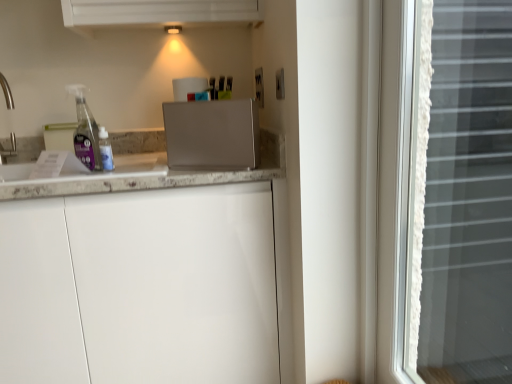
Question: Does white matte cabinet at center have a smaller size compared to satin silver toaster at center?

Choices:
 (A) yes
 (B) no

Answer: (B)

Question: Does white matte cabinet at center have a greater width compared to satin silver toaster at center?

Choices:
 (A) yes
 (B) no

Answer: (A)

Question: Is white matte cabinet at center far away from satin silver toaster at center?

Choices:
 (A) no
 (B) yes

Answer: (A)

Question: Considering the relative sizes of white matte cabinet at center and satin silver toaster at center in the image provided, is white matte cabinet at center thinner than satin silver toaster at center?

Choices:
 (A) yes
 (B) no

Answer: (B)

Question: Is white matte cabinet at center bigger than satin silver toaster at center?

Choices:
 (A) yes
 (B) no

Answer: (A)

Question: Is white matte cabinet at center oriented away from satin silver toaster at center?

Choices:
 (A) yes
 (B) no

Answer: (B)

Question: Is white marble countertop at left behind white matte cabinet at center?

Choices:
 (A) yes
 (B) no

Answer: (A)

Question: From the image's perspective, is white marble countertop at left on top of white matte cabinet at center?

Choices:
 (A) yes
 (B) no

Answer: (A)

Question: Is white marble countertop at left beside white matte cabinet at center?

Choices:
 (A) yes
 (B) no

Answer: (B)

Question: From the image's perspective, would you say white marble countertop at left is shown under white matte cabinet at center?

Choices:
 (A) no
 (B) yes

Answer: (A)

Question: Does white marble countertop at left have a lesser width compared to white matte cabinet at center?

Choices:
 (A) yes
 (B) no

Answer: (A)

Question: Is white marble countertop at left outside white matte cabinet at center?

Choices:
 (A) yes
 (B) no

Answer: (B)

Question: Is white matte cabinet at center to the left of white lace curtain at right from the viewer's perspective?

Choices:
 (A) yes
 (B) no

Answer: (A)